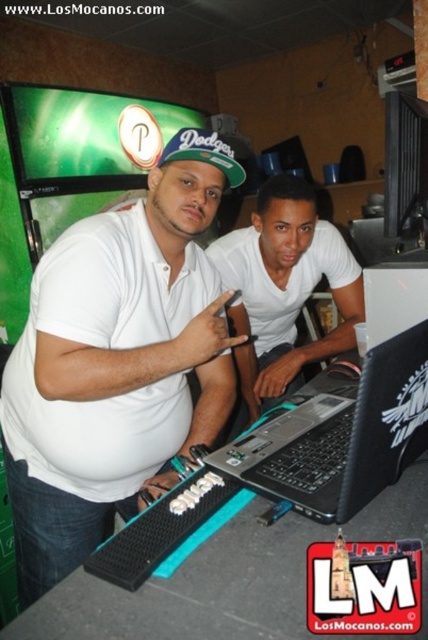
Question: Is white matte shirt at center further to the viewer compared to black plastic laptop at center?

Choices:
 (A) yes
 (B) no

Answer: (A)

Question: Among these points, which one is nearest to the camera?

Choices:
 (A) (303, 481)
 (B) (146, 314)
 (C) (273, 387)
 (D) (235, 166)

Answer: (A)

Question: Which of the following is the farthest from the observer?

Choices:
 (A) (196, 128)
 (B) (118, 385)

Answer: (A)

Question: Does black plastic laptop at center appear under green fabric baseball cap at center?

Choices:
 (A) no
 (B) yes

Answer: (B)

Question: Based on their relative distances, which object is nearer to the green fabric baseball cap at center?

Choices:
 (A) white matte shirt at center
 (B) white matte laptop at center
 (C) black plastic laptop at center

Answer: (A)

Question: Does black plastic laptop at center have a lesser width compared to green fabric baseball cap at center?

Choices:
 (A) no
 (B) yes

Answer: (A)